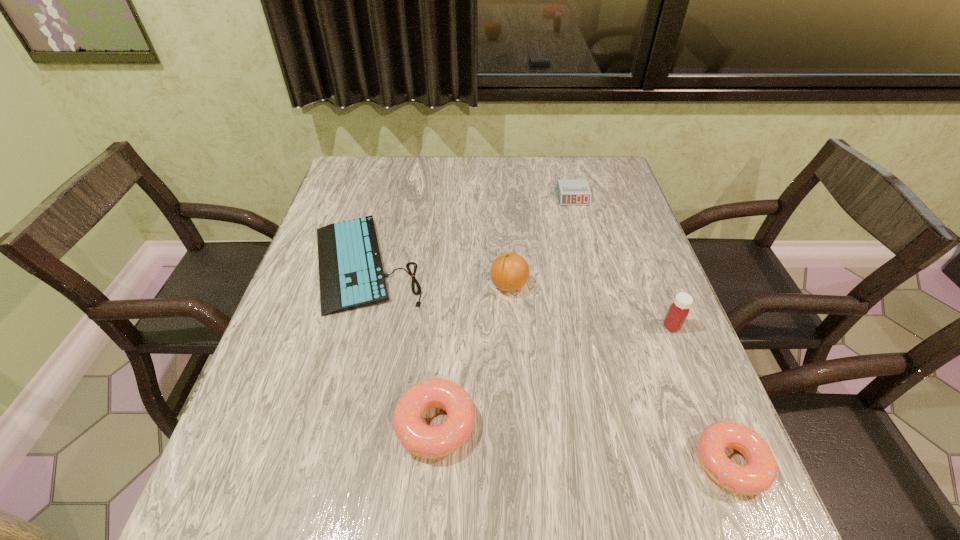
The image size is (960, 540). In order to click on the fourth shortest object in this screenshot , I will do `click(431, 442)`.

You are a GUI agent. You are given a task and a screenshot of the screen. Output one action in this format:
    pyautogui.click(x=<x>, y=<y>)
    Task: Click on the left doughnut
    The width and height of the screenshot is (960, 540).
    Given the screenshot: What is the action you would take?
    pyautogui.click(x=431, y=442)

The height and width of the screenshot is (540, 960). What are the coordinates of `the right doughnut` in the screenshot? It's located at (760, 472).

Find the location of a particular element. The height and width of the screenshot is (540, 960). the fourth tallest object is located at coordinates (760, 472).

Where is `alarm clock`? The width and height of the screenshot is (960, 540). alarm clock is located at coordinates (570, 192).

The image size is (960, 540). Identify the location of the third object from right to left. (570, 192).

I want to click on the third nearest object, so click(x=678, y=311).

The width and height of the screenshot is (960, 540). I want to click on the third object from left to right, so click(509, 272).

Find the location of `computer keyboard`. computer keyboard is located at coordinates (351, 275).

Identify the location of free space located on the back of the third tallest object. (444, 309).